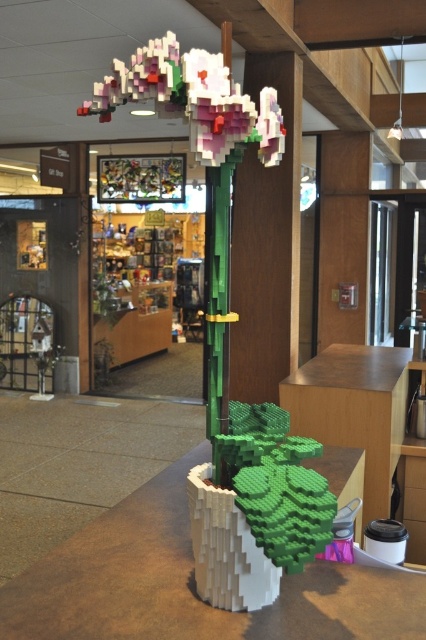
Question: Estimate the real-world distances between objects in this image. Which object is closer to the white matte table at center?

Choices:
 (A) pastel plastic flowers at upper center
 (B) wooden table at center

Answer: (A)

Question: Does white matte table at center appear over wooden table at center?

Choices:
 (A) yes
 (B) no

Answer: (B)

Question: Based on their relative distances, which object is farther from the pastel plastic flowers at upper center?

Choices:
 (A) white matte table at center
 (B) wooden table at center

Answer: (B)

Question: Does white matte table at center have a lesser width compared to wooden table at center?

Choices:
 (A) yes
 (B) no

Answer: (A)

Question: Is white matte table at center smaller than pastel plastic flowers at upper center?

Choices:
 (A) no
 (B) yes

Answer: (A)

Question: Which object is the closest to the white matte table at center?

Choices:
 (A) wooden table at center
 (B) pastel plastic flowers at upper center

Answer: (B)